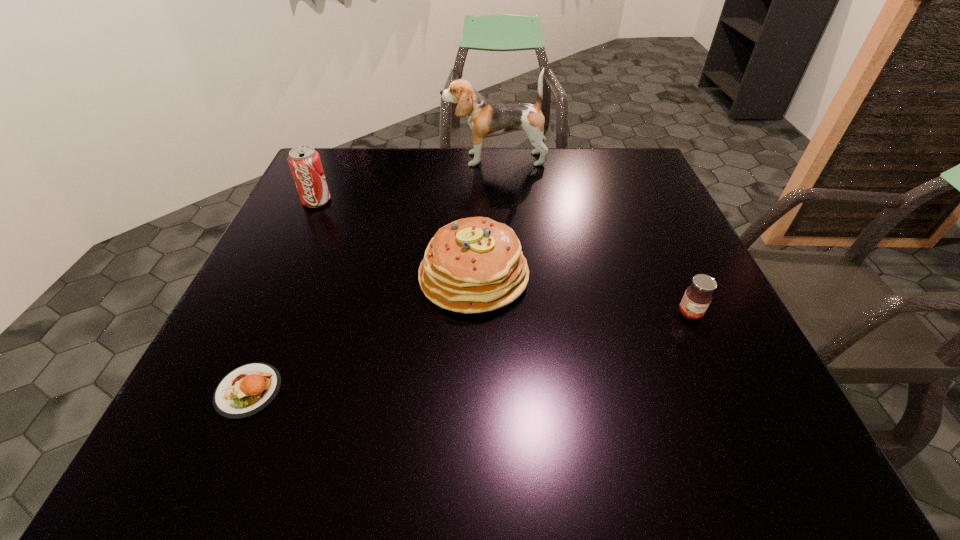
I want to click on vacant space positioned 0.260m at the face of the tallest object, so click(358, 159).

Locate an element on the screen. This screenshot has height=540, width=960. vacant space located at the face of the tallest object is located at coordinates (401, 159).

Where is `vacant point located 0.390m on the right of the soda can`? The height and width of the screenshot is (540, 960). vacant point located 0.390m on the right of the soda can is located at coordinates (478, 201).

Find the location of a particular element. This screenshot has width=960, height=540. vacant space located 0.270m on the left of the third tallest object is located at coordinates (295, 277).

Find the location of a particular element. free spot located on the label side of the jam is located at coordinates (742, 428).

Identify the location of vacant area situated 0.360m on the back of the patty (food). This screenshot has height=540, width=960. (314, 238).

Identify the location of object that is at the far edge. The width and height of the screenshot is (960, 540). (486, 118).

Find the location of a particular element. object present at the near edge is located at coordinates (245, 391).

Identify the location of soda can that is at the left edge. (305, 164).

The image size is (960, 540). Find the location of `patty (food) at the left edge`. patty (food) at the left edge is located at coordinates (245, 391).